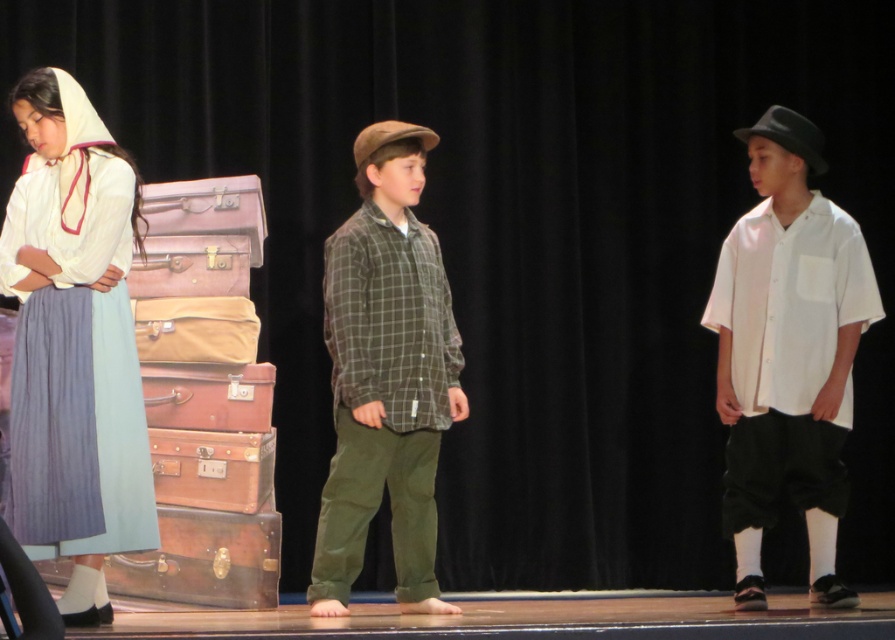
Which is more to the left, white cotton shirt at right or transparent leather suitcase at center?

transparent leather suitcase at center is more to the left.

Describe the element at coordinates (787, 353) in the screenshot. I see `white cotton shirt at right` at that location.

Is point (763, 496) in front of point (210, 563)?

Yes.

Where is `white cotton shirt at right`? Image resolution: width=895 pixels, height=640 pixels. white cotton shirt at right is located at coordinates (787, 353).

Is white cotton shirt at right positioned in front of green plaid shirt at center?

No, white cotton shirt at right is behind green plaid shirt at center.

The image size is (895, 640). Describe the element at coordinates (787, 353) in the screenshot. I see `white cotton shirt at right` at that location.

Find the location of a particular element. Image resolution: width=895 pixels, height=640 pixels. white cotton shirt at right is located at coordinates (787, 353).

Who is positioned more to the right, white cotton dress at left or white cotton shirt at right?

white cotton shirt at right

Does point (86, 323) lie in front of point (760, 605)?

Yes.

Image resolution: width=895 pixels, height=640 pixels. What are the coordinates of `white cotton dress at left` in the screenshot? It's located at (74, 346).